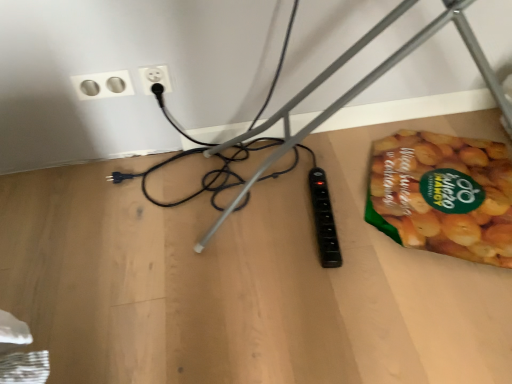
Question: Is point (145, 69) closer or farther from the camera than point (509, 185)?

Choices:
 (A) closer
 (B) farther

Answer: (A)

Question: Looking at their shapes, would you say white plastic socket at upper center, positioned as the first power plugs and sockets in right-to-left order, is wider or thinner than green matte snack packet at lower right?

Choices:
 (A) wide
 (B) thin

Answer: (B)

Question: Which object is positioned farthest from the silver metallic socket at upper left, marked as the first power plugs and sockets in a left-to-right arrangement?

Choices:
 (A) white plastic socket at upper center, positioned as the first power plugs and sockets in right-to-left order
 (B) green matte snack packet at lower right
 (C) wooden table at lower right
 (D) black plastic wire at lower right

Answer: (B)

Question: Based on their relative distances, which object is farther from the black plastic wire at lower right?

Choices:
 (A) white plastic socket at upper center, the 2th power plugs and sockets positioned from the left
 (B) green matte snack packet at lower right
 (C) silver metallic socket at upper left, marked as the first power plugs and sockets in a left-to-right arrangement
 (D) wooden table at lower right

Answer: (C)